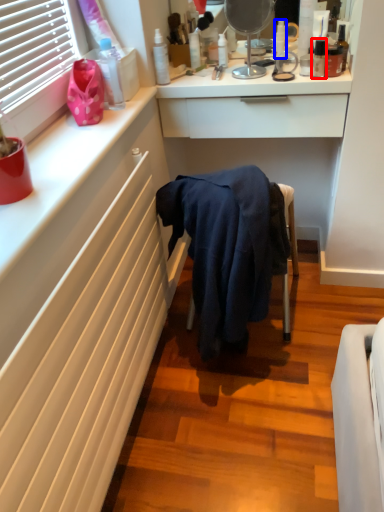
Question: Which object appears farthest to the camera in this image, toiletry (highlighted by a red box) or toiletry (highlighted by a blue box)?

Choices:
 (A) toiletry
 (B) toiletry

Answer: (B)